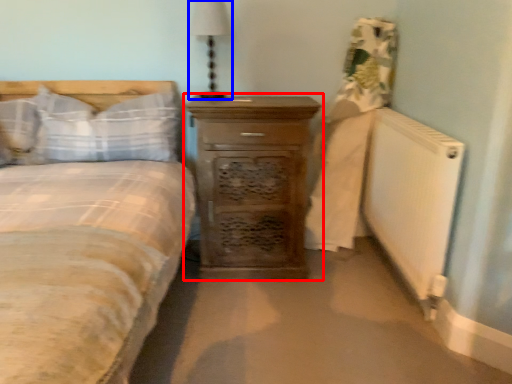
Question: Which object appears farthest to the camera in this image, chest of drawers (highlighted by a red box) or bedside lamp (highlighted by a blue box)?

Choices:
 (A) chest of drawers
 (B) bedside lamp

Answer: (B)